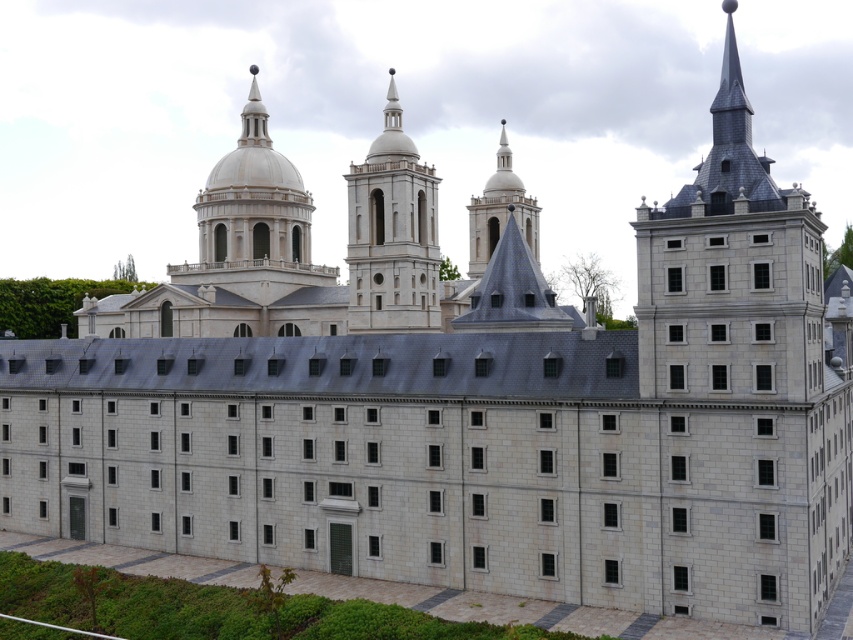
From the picture: You are an architect examining the central part of the building. You notice the white stone tower at center and the smooth gray steeple at center. Which of these two occupies a smaller area in the image?

The white stone tower at center occupies less space than smooth gray steeple at center, so the white stone tower at center is the smaller one in terms of area.

You are an architect evaluating the structural integrity of the gray stone tower at upper center and the white stone tower at center. Which tower has a larger base width to support its height?

The gray stone tower at upper center might be wider than white stone tower at center, so it likely has a larger base width to support its height.